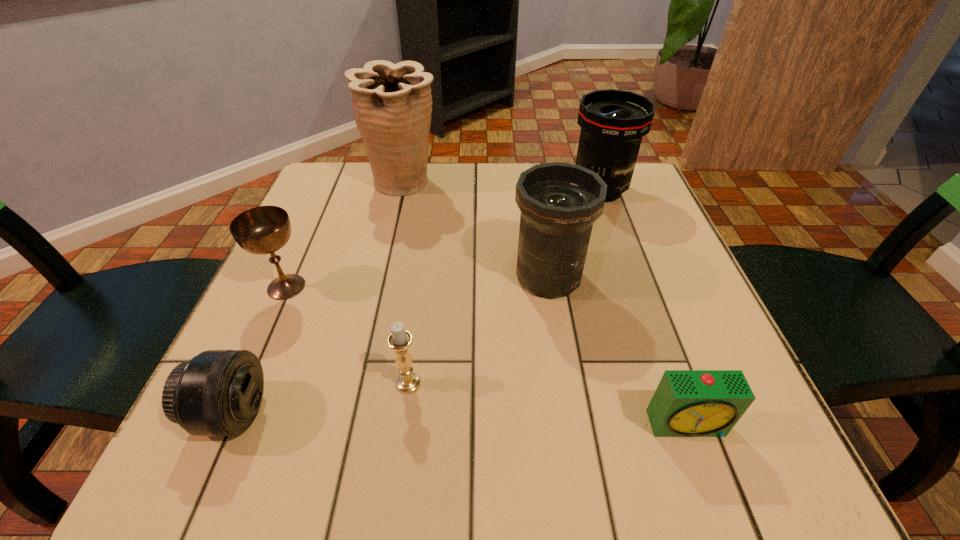
Where is `vacant region at the left edge of the desktop`? vacant region at the left edge of the desktop is located at coordinates (310, 291).

The width and height of the screenshot is (960, 540). What are the coordinates of `vacant space at the right edge of the desktop` in the screenshot? It's located at (640, 231).

In the image, there is a desktop. Find the location of `vacant space at the near left corner`. vacant space at the near left corner is located at coordinates (290, 473).

Locate an element on the screen. Image resolution: width=960 pixels, height=540 pixels. free spot between the candle holder and the farthest telephoto lens is located at coordinates (504, 287).

At what (x,y) coordinates should I click in order to perform the action: click on vacant area that lies between the rightmost telephoto lens and the urn. Please return your answer as a coordinate pair (x, y). This screenshot has width=960, height=540. Looking at the image, I should click on (501, 187).

This screenshot has height=540, width=960. What are the coordinates of `vacant area between the second farthest telephoto lens and the tallest object` in the screenshot? It's located at (476, 230).

Where is `vacant space that's between the second telephoto lens from left to right and the alarm clock`? vacant space that's between the second telephoto lens from left to right and the alarm clock is located at coordinates (618, 350).

Where is `free spot between the farthest telephoto lens and the nearest telephoto lens`? The height and width of the screenshot is (540, 960). free spot between the farthest telephoto lens and the nearest telephoto lens is located at coordinates (416, 302).

In order to click on free area in between the third object from right to left and the alarm clock in this screenshot , I will do `click(618, 350)`.

Locate an element on the screen. Image resolution: width=960 pixels, height=540 pixels. vacant region between the alarm clock and the candle holder is located at coordinates (547, 403).